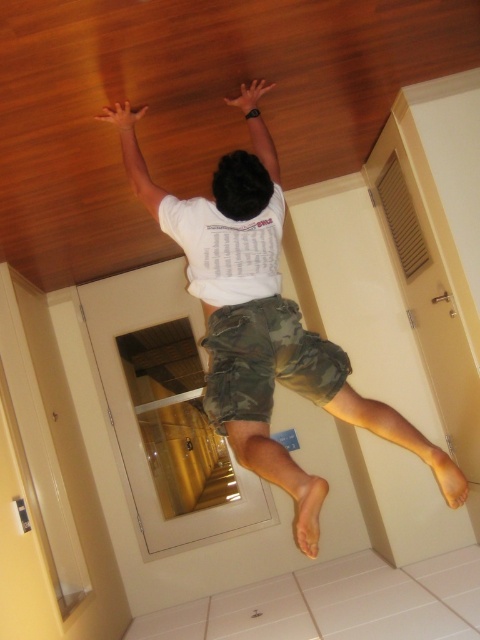
You are an interior designer assessing the space between two furniture pieces in the room. You notice the camo fabric shorts at lower center and the matte white arm at upper center. Based on their sizes, can you determine if the space between them is sufficient to place a standard 30 cm wide bookshelf?

The camo fabric shorts at lower center might be wider than matte white arm at upper center. However, without exact measurements of the distance between them, it is uncertain if the space can accommodate a 30 cm wide bookshelf. Further measurements are needed.

You are standing in the room and want to reach the point marked as point (182, 211). If you can jump 6 feet high, will you be able to reach that point?

The distance between you and point (182, 211) is 8.06 feet, which is higher than your jumping ability of 6 feet. Therefore, you cannot reach that point.